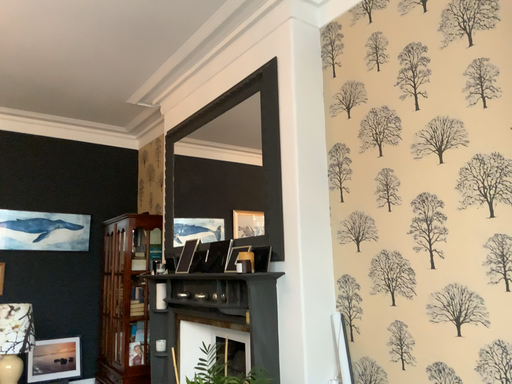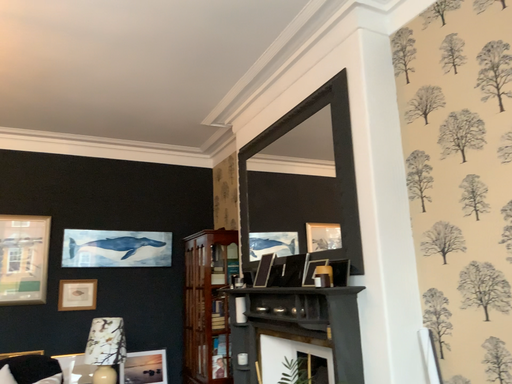
Question: How did the camera likely rotate when shooting the video?

Choices:
 (A) rotated left
 (B) rotated right

Answer: (A)